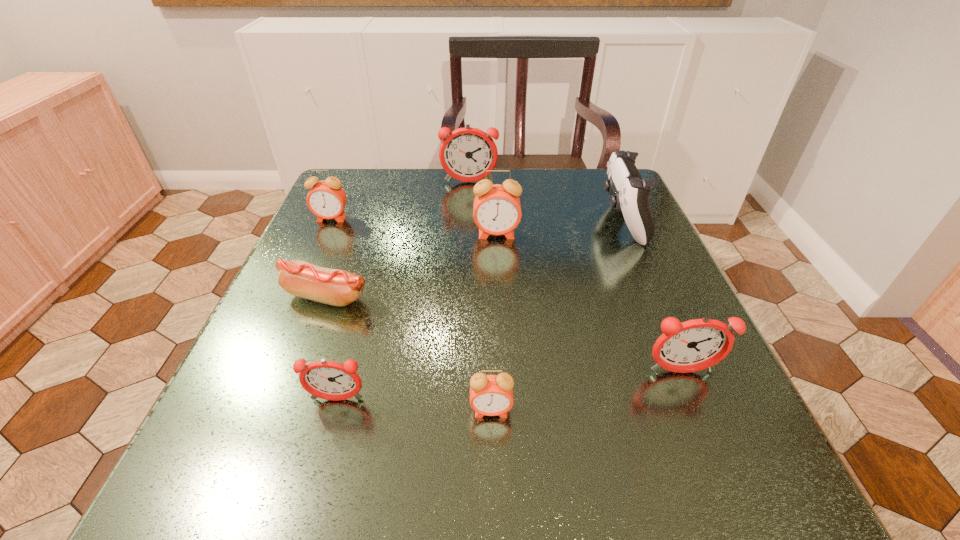
Locate an element on the screen. The height and width of the screenshot is (540, 960). the nearest reddish-pink alarm clock is located at coordinates (329, 380).

At what (x,y) coordinates should I click in order to perform the action: click on the nearest pink alarm clock. Please return your answer as a coordinate pair (x, y). Looking at the image, I should click on (491, 395).

At what (x,y) coordinates should I click in order to perform the action: click on sausage. Please return your answer as a coordinate pair (x, y). Looking at the image, I should click on (299, 278).

In order to click on the shortest object in this screenshot , I will do `click(299, 278)`.

Locate an element on the screen. vacant space located 0.130m on the front-facing side of the second reddish-pink alarm clock from right to left is located at coordinates (468, 214).

Where is `free region located 0.240m on the face of the biggest pink alarm clock`? This screenshot has height=540, width=960. free region located 0.240m on the face of the biggest pink alarm clock is located at coordinates (501, 323).

Where is `blank space located 0.190m on the front-facing side of the control`? blank space located 0.190m on the front-facing side of the control is located at coordinates (518, 220).

What are the coordinates of `free space located 0.260m on the front-facing side of the control` in the screenshot? It's located at (487, 220).

Image resolution: width=960 pixels, height=540 pixels. Find the location of `free space located 0.330m on the front-facing side of the control`. free space located 0.330m on the front-facing side of the control is located at coordinates point(456,220).

This screenshot has height=540, width=960. What are the coordinates of `vacant space located on the face of the fifth nearest alarm clock` in the screenshot? It's located at (308, 269).